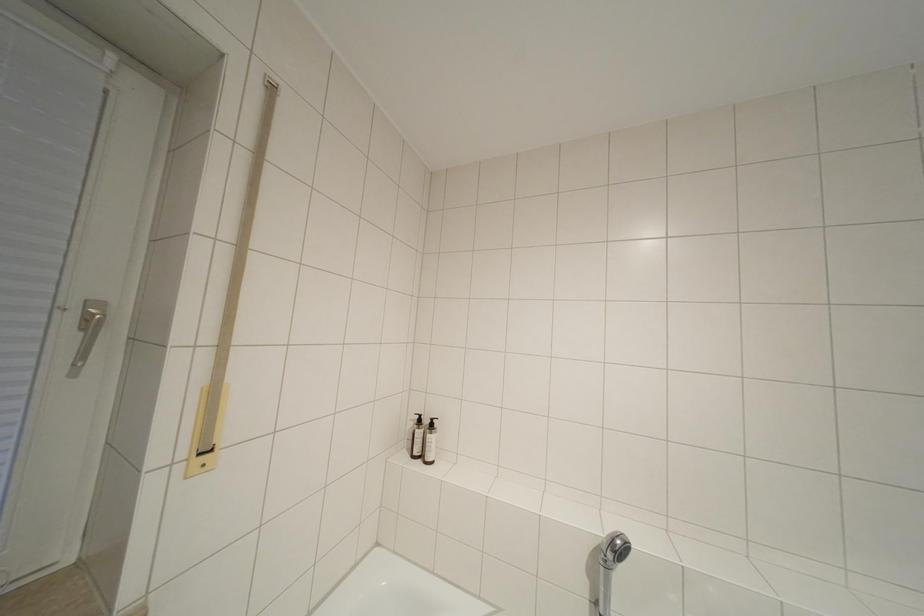
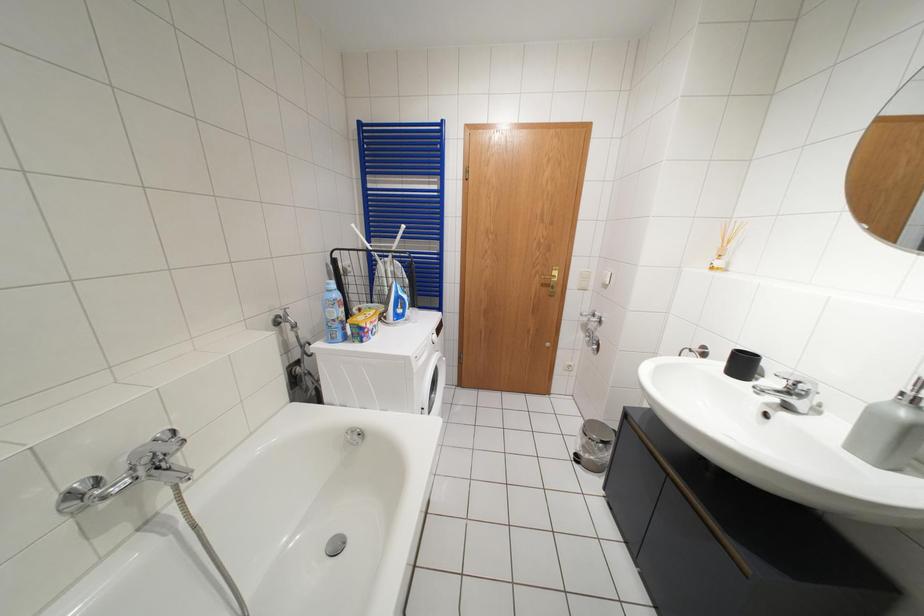
First-person continuous shooting, in which direction is the camera rotating?

The camera's rotation is toward right-down.